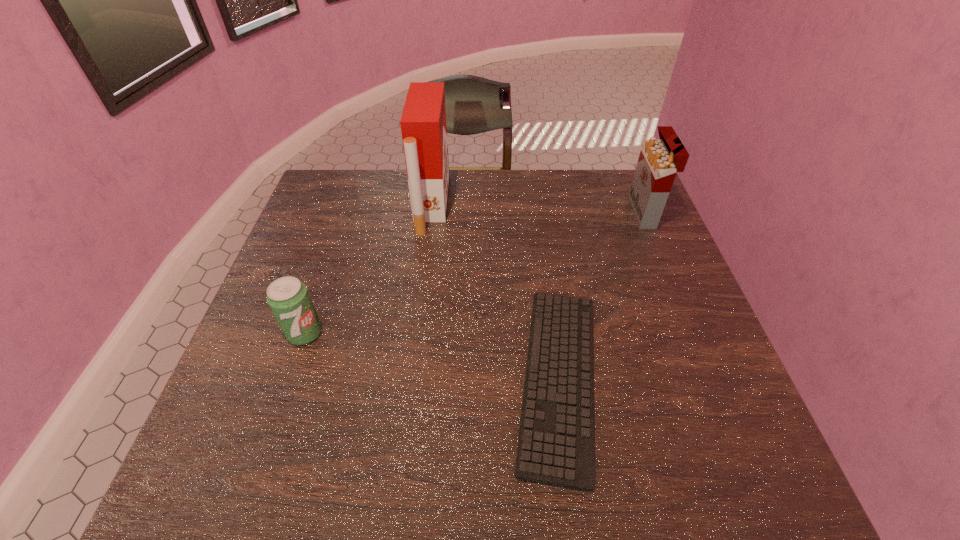
Find the location of a particular element. The height and width of the screenshot is (540, 960). vacant space in between the second object from right to left and the second shortest object is located at coordinates (432, 356).

Image resolution: width=960 pixels, height=540 pixels. In order to click on free spot between the computer keyboard and the tallest object in this screenshot , I will do tap(495, 292).

You are a GUI agent. You are given a task and a screenshot of the screen. Output one action in this format:
    pyautogui.click(x=<x>, y=<y>)
    Task: Click on the unoccupied position between the taller cigarette case and the rightmost object
    
    Given the screenshot: What is the action you would take?
    pyautogui.click(x=538, y=208)

Where is `free spot between the third shortest object and the leftmost object`? The image size is (960, 540). free spot between the third shortest object and the leftmost object is located at coordinates (474, 273).

Identify the location of vacant region between the shortest object and the taller cigarette case. (495, 292).

Identify which object is the nearest to the soda. Please provide its 2D coordinates. Your answer should be formatted as a tuple, i.e. [(x, y)], where the tuple contains the x and y coordinates of a point satisfying the conditions above.

[(423, 124)]

Locate which object ranks second in proximity to the right cigarette case. Please provide its 2D coordinates. Your answer should be formatted as a tuple, i.e. [(x, y)], where the tuple contains the x and y coordinates of a point satisfying the conditions above.

[(423, 124)]

Locate an element on the screen. Image resolution: width=960 pixels, height=540 pixels. free region that satisfies the following two spatial constraints: 1. on the front-facing side of the tallest object; 2. on the back side of the computer keyboard is located at coordinates (410, 379).

The width and height of the screenshot is (960, 540). Find the location of `free space that satisfies the following two spatial constraints: 1. on the front-facing side of the left cigarette case; 2. on the back side of the shortest object`. free space that satisfies the following two spatial constraints: 1. on the front-facing side of the left cigarette case; 2. on the back side of the shortest object is located at coordinates (410, 379).

I want to click on vacant space that satisfies the following two spatial constraints: 1. with the lid open on the second tallest object; 2. on the front side of the soda, so click(694, 333).